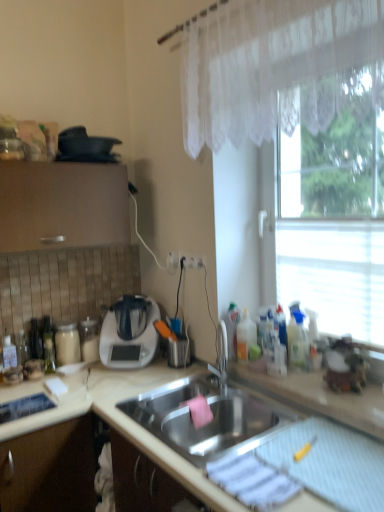
Question: Is white plastic appliance at center-left, which is the second appliance in top-to-bottom order, taller than white plastic electric outlet at center?

Choices:
 (A) yes
 (B) no

Answer: (A)

Question: Can you confirm if white plastic appliance at center-left, which is the second appliance in top-to-bottom order, is positioned to the left of white plastic electric outlet at center?

Choices:
 (A) no
 (B) yes

Answer: (B)

Question: Could you tell me if white plastic appliance at center-left, which is counted as the first appliance, starting from the bottom, is turned towards white plastic electric outlet at center?

Choices:
 (A) no
 (B) yes

Answer: (A)

Question: From the image's perspective, is white plastic appliance at center-left, which is counted as the first appliance, starting from the bottom, located above white plastic electric outlet at center?

Choices:
 (A) no
 (B) yes

Answer: (A)

Question: Does white plastic appliance at center-left, which is the second appliance in top-to-bottom order, have a larger size compared to white plastic electric outlet at center?

Choices:
 (A) no
 (B) yes

Answer: (B)

Question: Could white plastic electric outlet at center be considered to be inside white plastic appliance at center-left, which is the second appliance in top-to-bottom order?

Choices:
 (A) no
 (B) yes

Answer: (A)

Question: Is white plastic appliance at center-left, which is counted as the first appliance, starting from the bottom, in contact with beige matte countertop at center?

Choices:
 (A) yes
 (B) no

Answer: (B)

Question: Considering the relative sizes of white plastic appliance at center-left, which is counted as the first appliance, starting from the bottom, and beige matte countertop at center in the image provided, is white plastic appliance at center-left, which is counted as the first appliance, starting from the bottom, thinner than beige matte countertop at center?

Choices:
 (A) no
 (B) yes

Answer: (B)

Question: Is white plastic appliance at center-left, which is the second appliance in top-to-bottom order, at the left side of beige matte countertop at center?

Choices:
 (A) no
 (B) yes

Answer: (B)

Question: From a real-world perspective, does white plastic appliance at center-left, which is the second appliance in top-to-bottom order, stand above beige matte countertop at center?

Choices:
 (A) no
 (B) yes

Answer: (B)

Question: Is white plastic appliance at center-left, which is the second appliance in top-to-bottom order, to the right of beige matte countertop at center from the viewer's perspective?

Choices:
 (A) no
 (B) yes

Answer: (A)

Question: Is white plastic appliance at center-left, which is counted as the first appliance, starting from the bottom, looking in the opposite direction of beige matte countertop at center?

Choices:
 (A) yes
 (B) no

Answer: (B)

Question: Is stainless steel sink at center further to camera compared to white lace curtain at upper right?

Choices:
 (A) yes
 (B) no

Answer: (A)